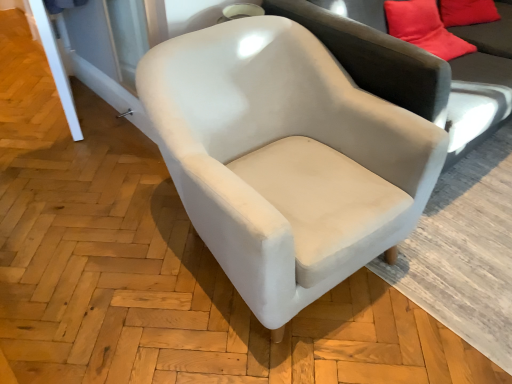
Locate an element on the screen. free space to the left of white velvet chair at center is located at coordinates (98, 234).